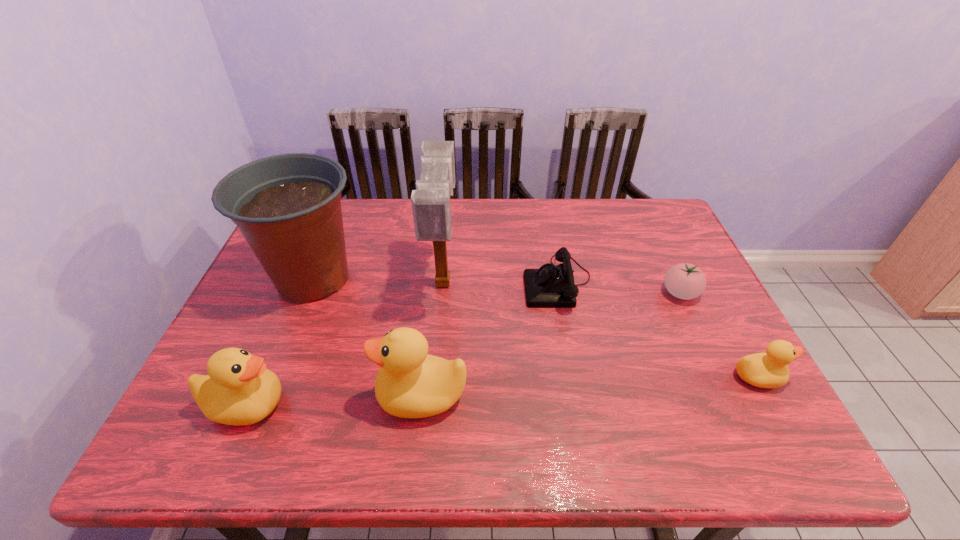
The width and height of the screenshot is (960, 540). Find the location of `the leftmost duck`. the leftmost duck is located at coordinates (238, 390).

In order to click on the second shortest duck in this screenshot , I will do `click(238, 390)`.

The image size is (960, 540). What are the coordinates of `the second duck from right to left` in the screenshot? It's located at (410, 383).

The image size is (960, 540). Find the location of `the rightmost duck`. the rightmost duck is located at coordinates (764, 370).

Where is `telephone`? The image size is (960, 540). telephone is located at coordinates (550, 286).

This screenshot has width=960, height=540. Find the location of `the sixth shortest object`. the sixth shortest object is located at coordinates (288, 208).

You are a GUI agent. You are given a task and a screenshot of the screen. Output one action in this format:
    pyautogui.click(x=<x>, y=<y>)
    Task: Click on the mallet
    The image size is (960, 540).
    Given the screenshot: What is the action you would take?
    pyautogui.click(x=430, y=201)

Find the location of a particular element. This screenshot has height=540, width=960. tomato is located at coordinates (686, 281).

Find the location of a particular element. The image size is (960, 540). free location located at the beak of the leftmost duck is located at coordinates (308, 405).

Where is `free point located at the beak of the second duck from right to left`? The height and width of the screenshot is (540, 960). free point located at the beak of the second duck from right to left is located at coordinates (224, 395).